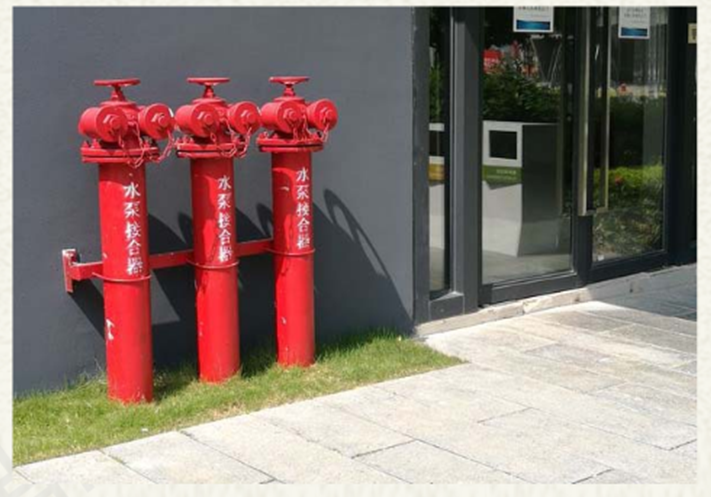
At what (x,y) coordinates should I click in order to perform the action: click on glass doors. Please return your answer as a coordinate pair (x, y). The image size is (711, 497). Looking at the image, I should click on (532, 195), (658, 207).